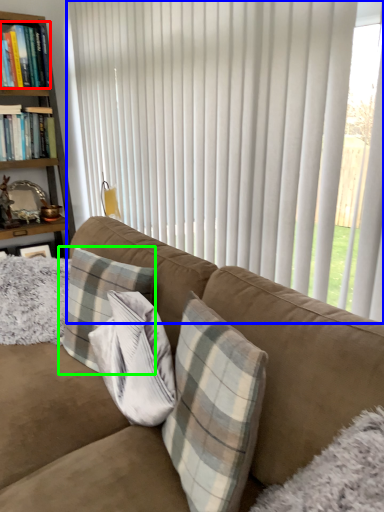
Question: Considering the real-world distances, which object is closest to book (highlighted by a red box)? curtain (highlighted by a blue box) or pillow (highlighted by a green box).

Choices:
 (A) curtain
 (B) pillow

Answer: (A)